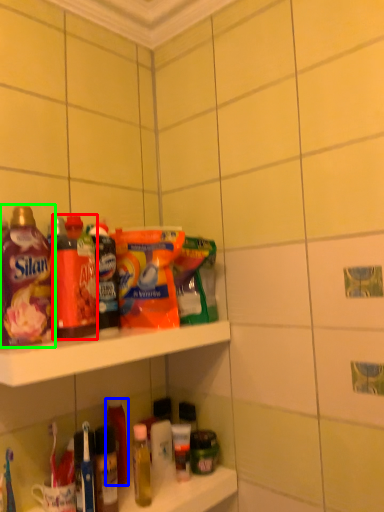
Question: Estimate the real-world distances between objects in this image. Which object is closer to bottle (highlighted by a red box), bottle (highlighted by a blue box) or bottle (highlighted by a green box)?

Choices:
 (A) bottle
 (B) bottle

Answer: (B)